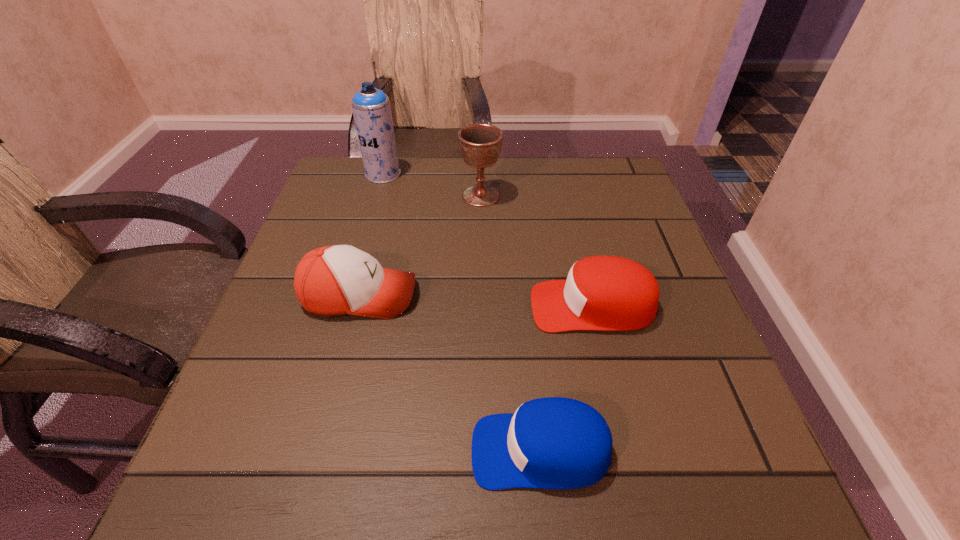
The image size is (960, 540). In order to click on vacant space that's between the fourth shortest object and the leftmost baseball cap in this screenshot , I will do `click(420, 246)`.

The image size is (960, 540). I want to click on free space between the fourth shortest object and the shortest object, so click(511, 323).

Identify which object is the second nearest to the tallest object. Please provide its 2D coordinates. Your answer should be formatted as a tuple, i.e. [(x, y)], where the tuple contains the x and y coordinates of a point satisfying the conditions above.

[(335, 280)]

Locate which object ranks in proximity to the nearest object. Please provide its 2D coordinates. Your answer should be formatted as a tuple, i.e. [(x, y)], where the tuple contains the x and y coordinates of a point satisfying the conditions above.

[(603, 293)]

At what (x,y) coordinates should I click in order to perform the action: click on baseball cap object that ranks as the second closest to the fourth nearest object. Please return your answer as a coordinate pair (x, y). Image resolution: width=960 pixels, height=540 pixels. Looking at the image, I should click on (603, 293).

You are a GUI agent. You are given a task and a screenshot of the screen. Output one action in this format:
    pyautogui.click(x=<x>, y=<y>)
    Task: Click on the baseball cap identified as the second closest to the shortest baseball cap
    This screenshot has height=540, width=960.
    Given the screenshot: What is the action you would take?
    pyautogui.click(x=335, y=280)

Identify the location of free region that satisfies the following two spatial constraints: 1. on the front side of the fourth nearest object; 2. on the right side of the aerosol can. (377, 195).